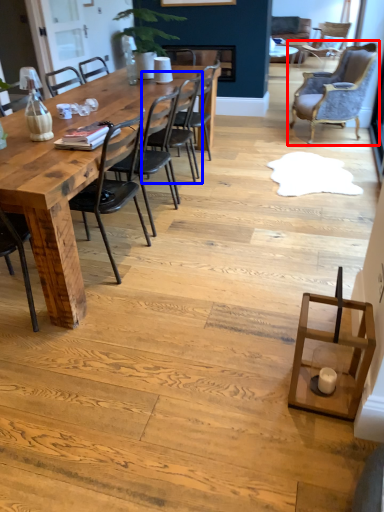
Question: Which of the following is the closest to the observer, chair (highlighted by a red box) or chair (highlighted by a blue box)?

Choices:
 (A) chair
 (B) chair

Answer: (B)